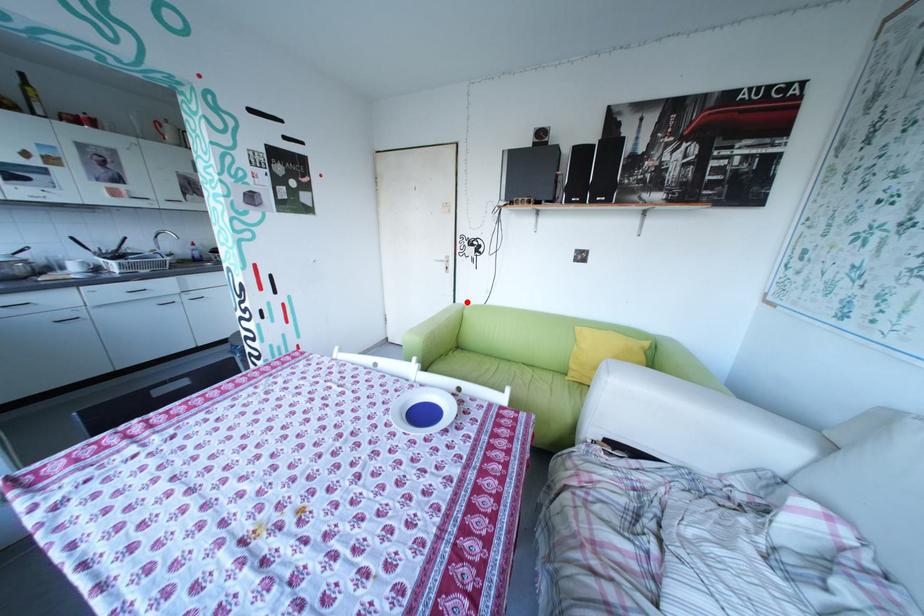
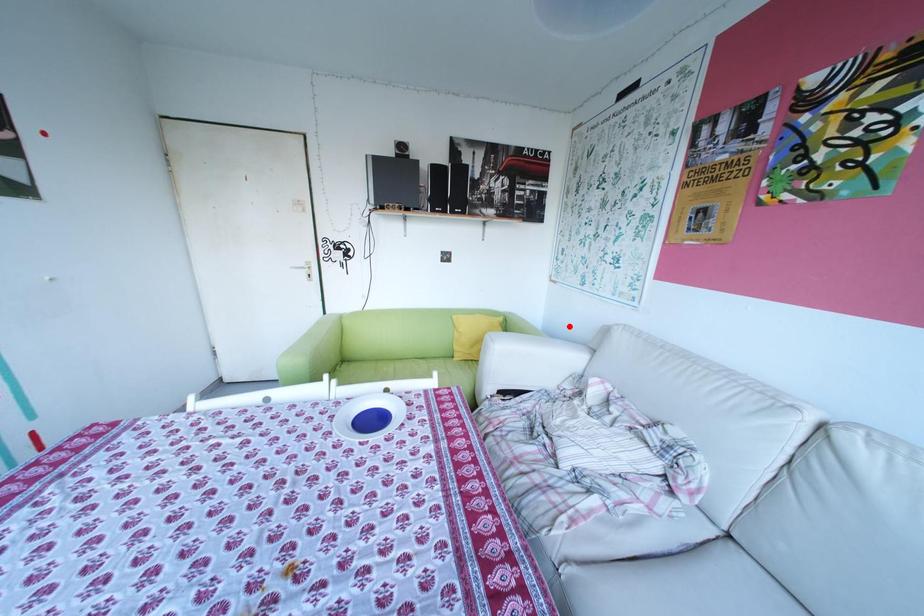
I am providing you with two images of the same scene from different viewpoints. A red point is marked on the first image and another point is marked on the second image. Are the points marked in image1 and image2 representing the same 3D position?

No